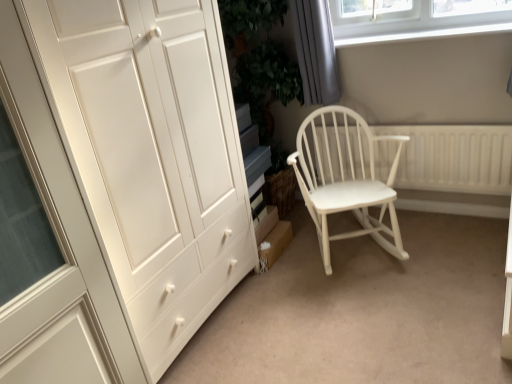
Question: Is white textured radiator at right situated inside matte white wardrobe at left or outside?

Choices:
 (A) inside
 (B) outside

Answer: (B)

Question: Looking at the image, does white textured radiator at right seem bigger or smaller compared to matte white wardrobe at left?

Choices:
 (A) big
 (B) small

Answer: (B)

Question: Which is farther from the white wood rocking chair at center?

Choices:
 (A) matte white wardrobe at left
 (B) white textured radiator at right
 (C) white wood rocking chair at center
 (D) white plastic window sill at upper right
 (E) gray fabric curtain at upper right

Answer: (A)

Question: Which of these objects is positioned farthest from the gray fabric curtain at upper right?

Choices:
 (A) white textured radiator at right
 (B) matte white wardrobe at left
 (C) white plastic window sill at upper right
 (D) white wood rocking chair at center
 (E) white wood rocking chair at center

Answer: (E)